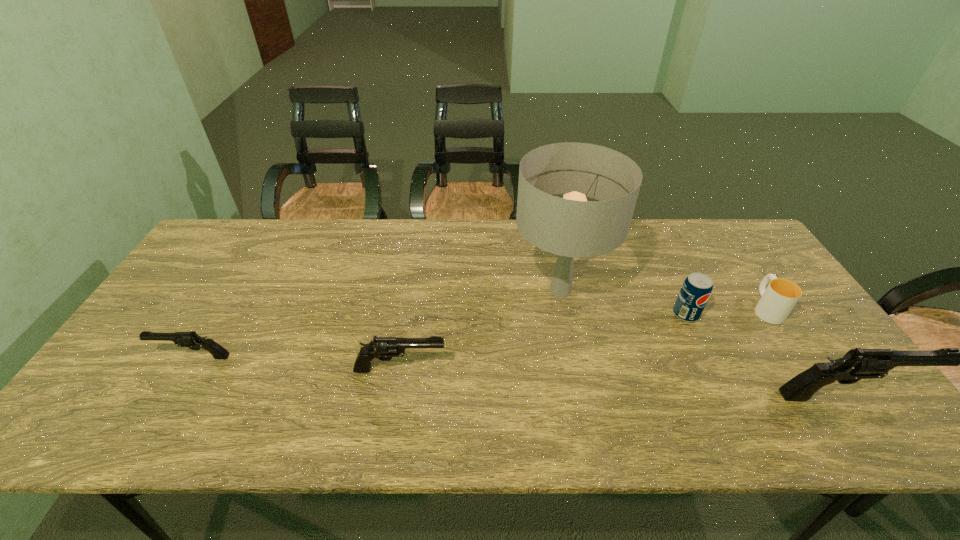
At what (x,y) coordinates should I click in order to perform the action: click on object that ranks as the closest to the pop. Please return your answer as a coordinate pair (x, y). The width and height of the screenshot is (960, 540). Looking at the image, I should click on (571, 227).

Locate an element on the screen. object that can be found as the third closest to the shortest gun is located at coordinates (697, 287).

Find the location of a particular element. gun that stands as the closest to the tallest object is located at coordinates (384, 348).

This screenshot has height=540, width=960. Find the location of `gun that stands as the third closest to the cup`. gun that stands as the third closest to the cup is located at coordinates (191, 340).

This screenshot has height=540, width=960. What are the coordinates of `vacant area in the image that satisfies the following two spatial constraints: 1. on the front-facing side of the fourth object from right to left; 2. with the handle on the side of the cup` in the screenshot? It's located at (564, 308).

Locate an element on the screen. This screenshot has height=540, width=960. free space in the image that satisfies the following two spatial constraints: 1. on the front-facing side of the third object from left to right; 2. on the back side of the pop is located at coordinates (565, 314).